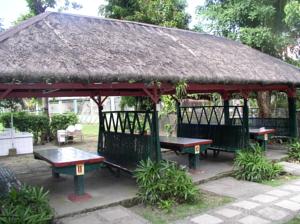
This screenshot has height=224, width=300. Identify the location of things i could use to sit. (62, 135), (69, 131), (75, 127), (120, 162), (220, 146).